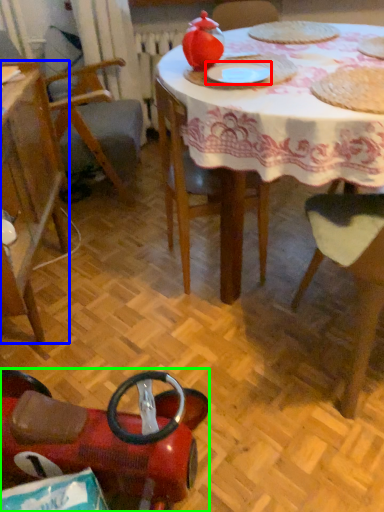
Question: Considering the real-world distances, which object is farthest from paper plate (highlighted by a red box)? chair (highlighted by a blue box) or chair (highlighted by a green box)?

Choices:
 (A) chair
 (B) chair

Answer: (B)